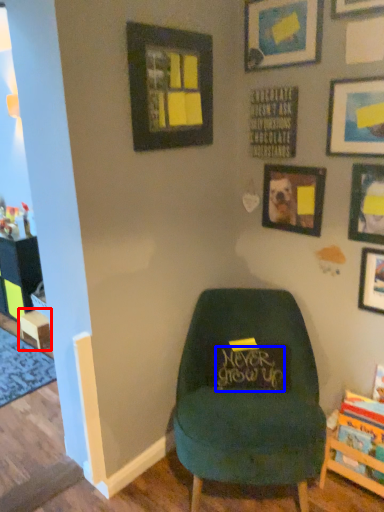
Question: Which object appears farthest to the camera in this image, table (highlighted by a red box) or writing (highlighted by a blue box)?

Choices:
 (A) table
 (B) writing

Answer: (A)